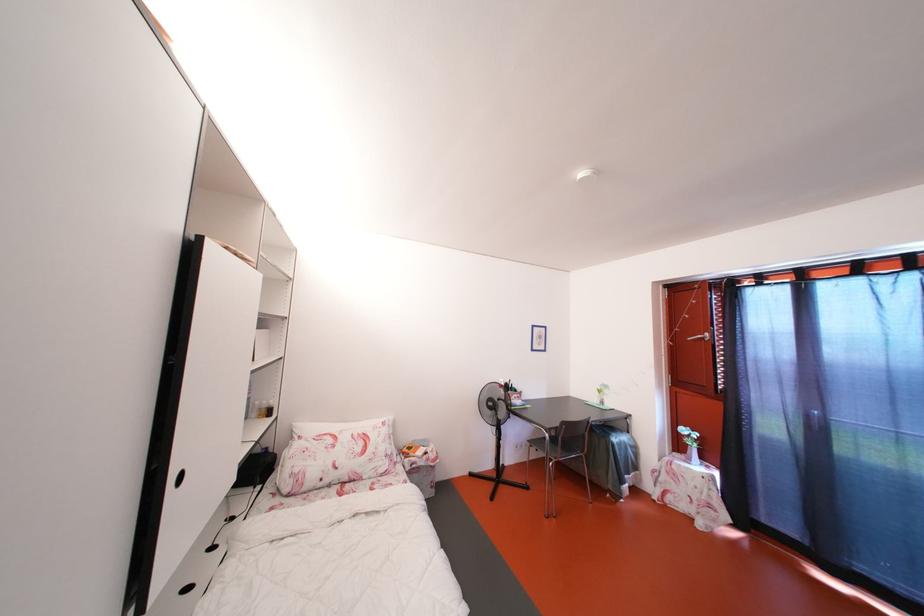
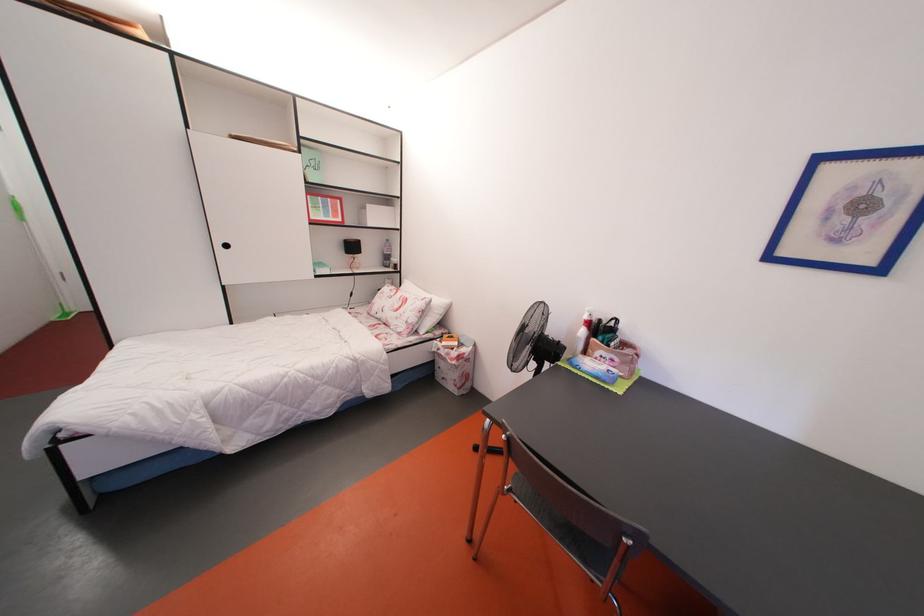
The point at (x=429, y=469) is marked in the first image. Where is the corresponding point in the second image?

(450, 360)